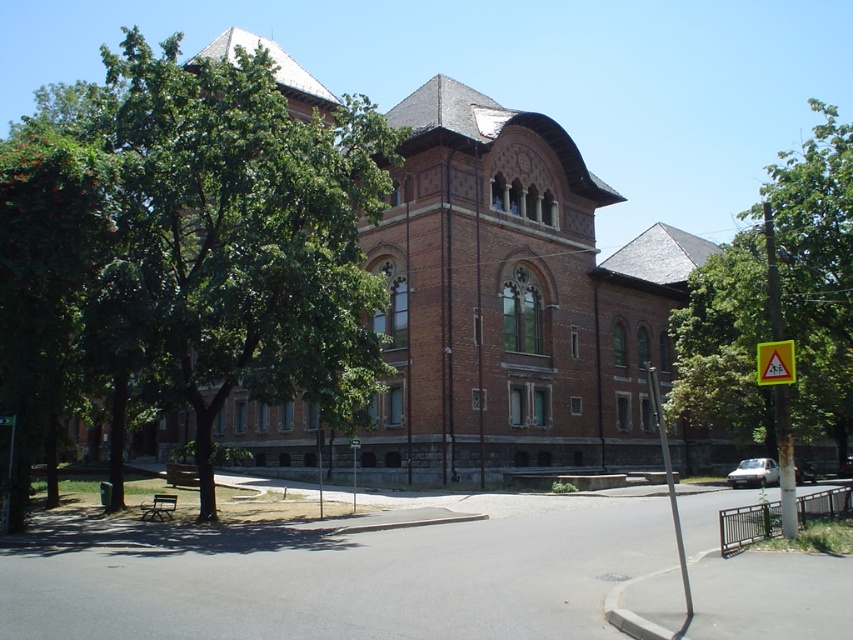
Can you confirm if green leafy tree at center is positioned above yellow plastic sign at center?

Yes, green leafy tree at center is above yellow plastic sign at center.

Does green leafy tree at center appear on the right side of yellow plastic sign at center?

No, green leafy tree at center is not to the right of yellow plastic sign at center.

Where is `green leafy tree at center`? The width and height of the screenshot is (853, 640). green leafy tree at center is located at coordinates (194, 237).

Is point (846, 337) positioned behind point (779, 368)?

That is True.

What do you see at coordinates (817, 273) in the screenshot? I see `green leafy tree at right` at bounding box center [817, 273].

The height and width of the screenshot is (640, 853). In order to click on green leafy tree at right in this screenshot , I will do `click(817, 273)`.

Is point (502, 326) positioned before point (775, 372)?

No, it is not.

Who is higher up, brown brick church at center or yellow triangular sign at upper right?

brown brick church at center

The width and height of the screenshot is (853, 640). Identify the location of brown brick church at center. (511, 301).

At what (x,y) coordinates should I click in order to perform the action: click on brown brick church at center. Please return your answer as a coordinate pair (x, y). This screenshot has height=640, width=853. Looking at the image, I should click on pyautogui.click(x=511, y=301).